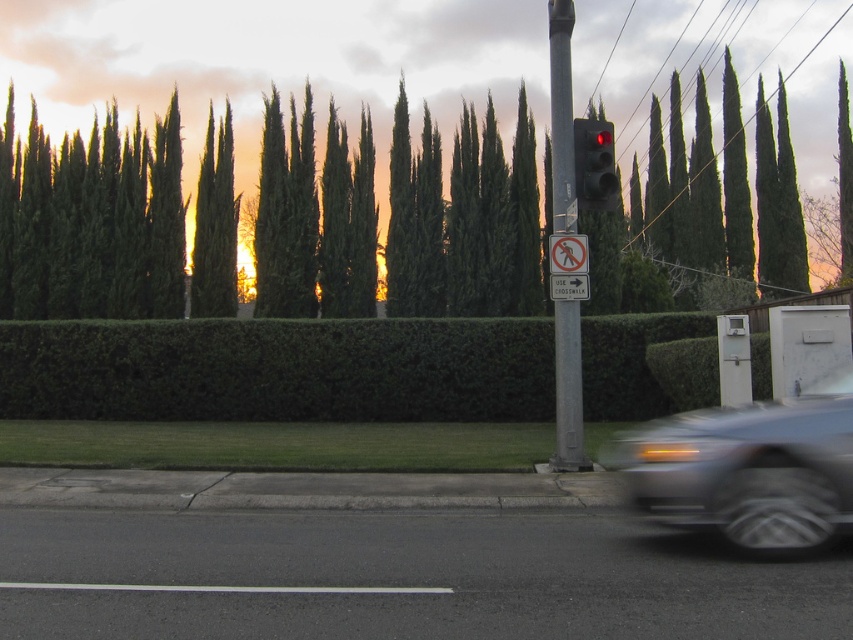
You are a delivery person on a bicycle and you need to deliver a package to the address located at the point with coordinates point (549, 3) and point (576, 176). Which point is closer to the traffic light pole on the right side of the frame?

Point (576, 176) is closer to the traffic light pole on the right side of the frame because it is in front of point (549, 3), which is further away.

You are a pedestrian wanting to cross the street safely. You see the green leafy trees at upper center and the metallic gray car at lower right. Which object is higher in the image?

The green leafy trees at upper center are higher in the image than the metallic gray car at lower right.

You are a delivery drone flying above the street scene. You need to deliver a package to the green leafy trees at upper center. According to the coordinates provided, where should you aim your drone to drop the package?

The green leafy trees at upper center are located at the 2D coordinates point (91, 221), so you should aim your drone at that coordinate to drop the package.